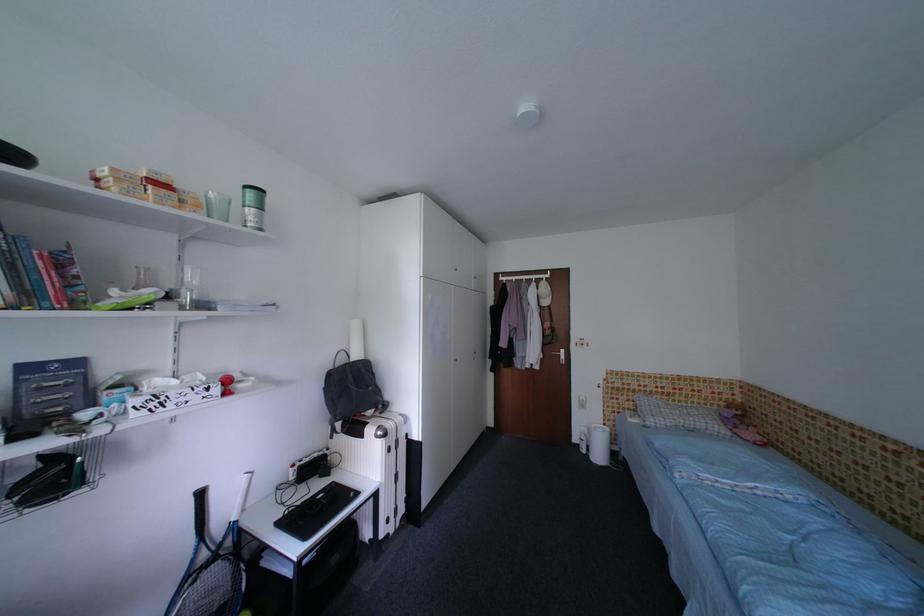
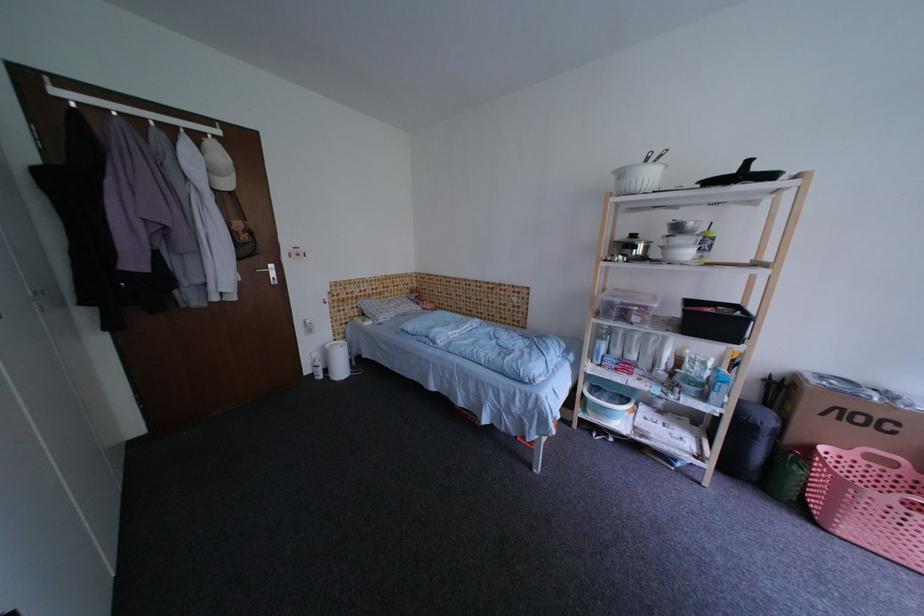
Locate, in the second image, the point that corresponds to [582,442] in the first image.

(314, 374)